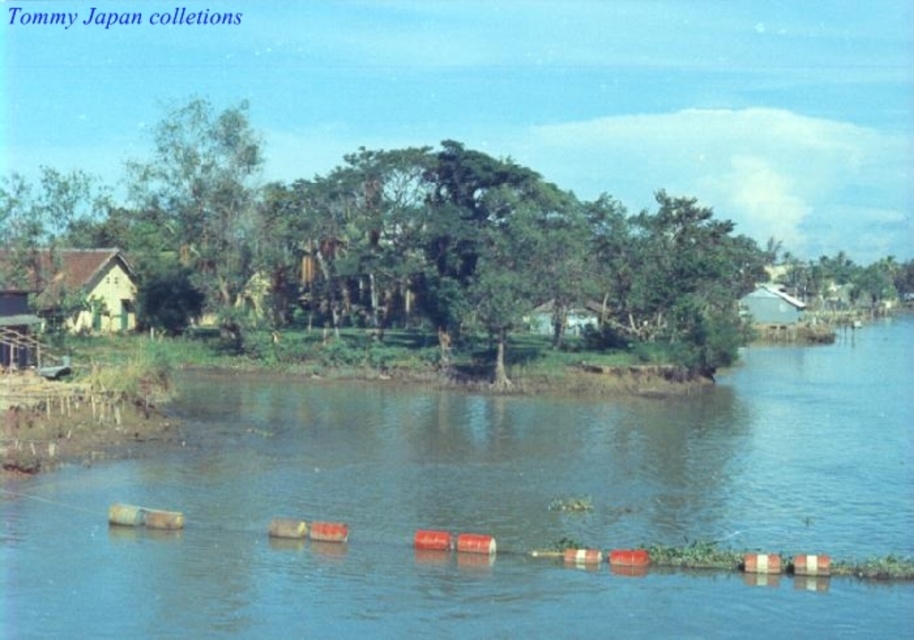
You are standing on the riverside path and see the smooth concrete river at center and the green leafy tree at center. Which object is positioned to the right of the other?

The smooth concrete river at center is to the right of green leafy tree at center.